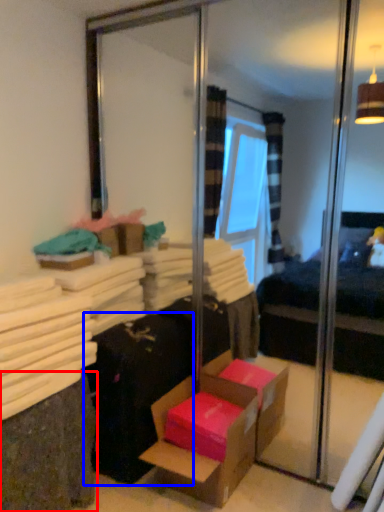
Question: Which of the following is the farthest to the observer, shelf (highlighted by a red box) or luggage (highlighted by a blue box)?

Choices:
 (A) shelf
 (B) luggage

Answer: (B)